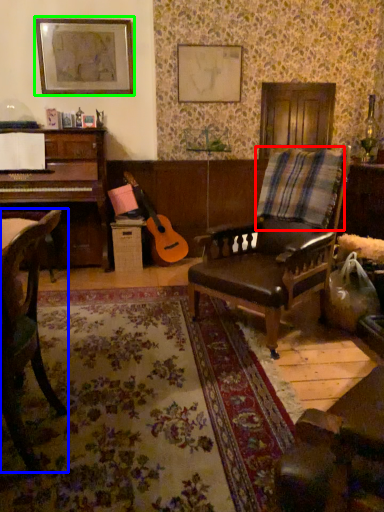
Question: Estimate the real-world distances between objects in this image. Which object is farther from plaid (highlighted by a red box), chair (highlighted by a blue box) or picture frame (highlighted by a green box)?

Choices:
 (A) chair
 (B) picture frame

Answer: (B)